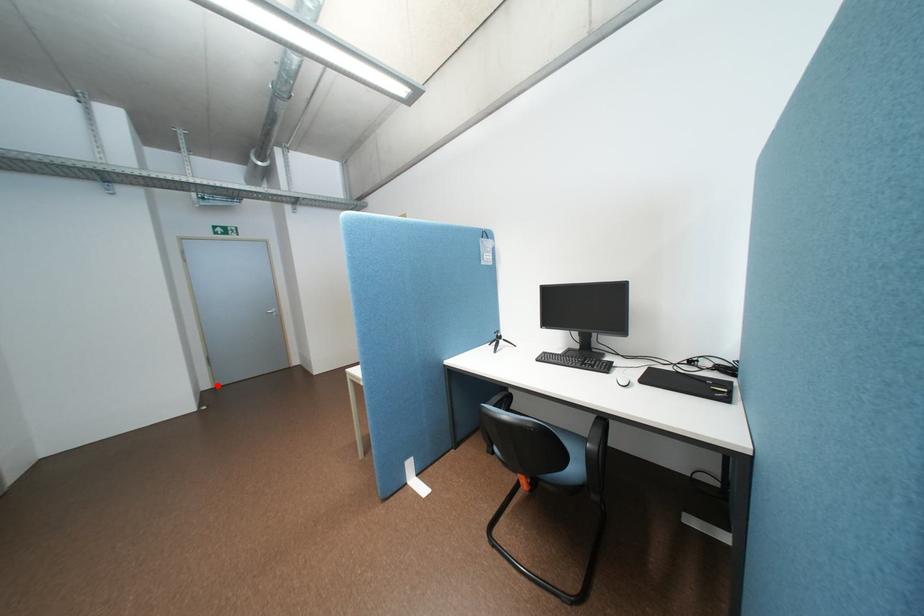
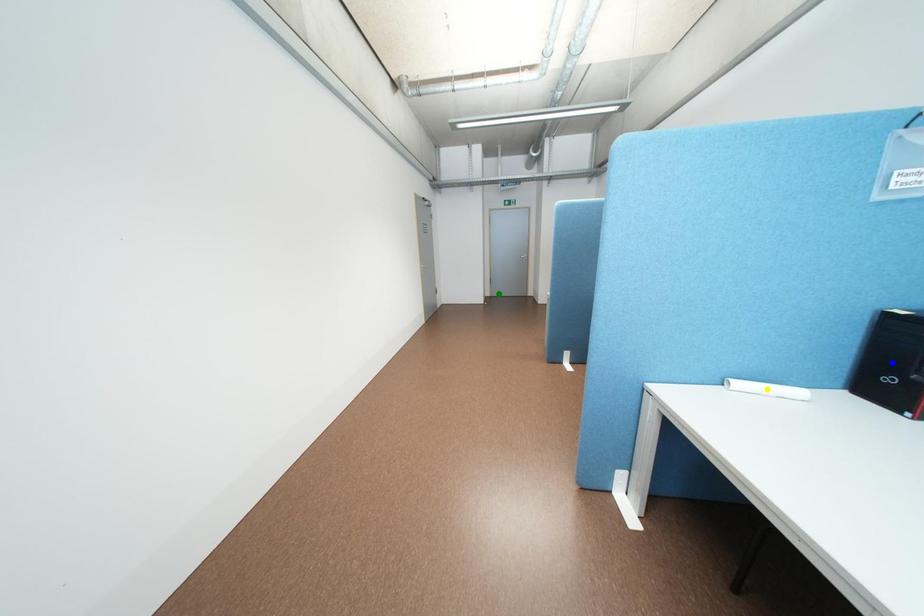
Question: I am providing you with two images of the same scene from different viewpoints. A red point is marked on the first image. You are given multiple points on the second image. Which point in image 2 is actually the same real-world point as the red point in image 1?

Choices:
 (A) green point
 (B) yellow point
 (C) blue point

Answer: (A)